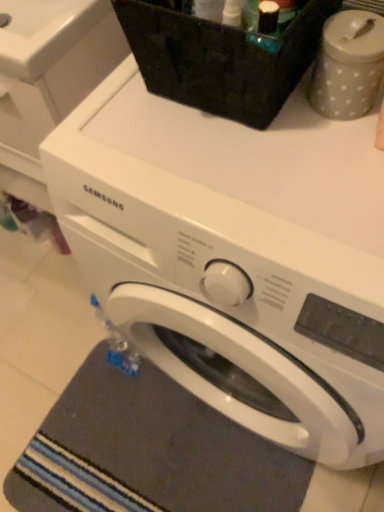
In order to click on blank space situated above white glossy washing machine at center, which is the 2th washing machine from left to right (from a real-world perspective) in this screenshot , I will do point(253,179).